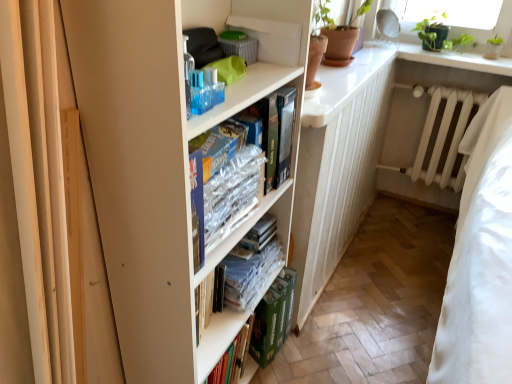
The image size is (512, 384). I want to click on white matte bookcase at center, so click(148, 175).

The width and height of the screenshot is (512, 384). What do you see at coordinates (205, 90) in the screenshot?
I see `transparent plastic bottle at upper center` at bounding box center [205, 90].

Describe the element at coordinates (273, 318) in the screenshot. I see `green cardboard book at lower center` at that location.

Measure the distance between white glossy counter top at upper right and camera.

white glossy counter top at upper right and camera are 1.29 meters apart.

The image size is (512, 384). Describe the element at coordinates (275, 133) in the screenshot. I see `hardcover book at center, the 2th book from the bottom` at that location.

This screenshot has width=512, height=384. What do you see at coordinates (251, 267) in the screenshot?
I see `clear plastic books at center, which appears as the 2th book when viewed from the top` at bounding box center [251, 267].

Find the location of `white smooth window sill at upper right`. white smooth window sill at upper right is located at coordinates (443, 58).

Locate an element on the screen. white matte bookcase at center is located at coordinates (148, 175).

Is hardcover book at center, the 2th book from the bottom, far from white matte bookcase at center?

That's not correct — hardcover book at center, the 2th book from the bottom, is a little close to white matte bookcase at center.

Is point (250, 114) in front of point (96, 26)?

No, it is behind (96, 26).

Is hardcover book at center, the 2th book from the bottom, smaller than white matte bookcase at center?

Correct, hardcover book at center, the 2th book from the bottom, occupies less space than white matte bookcase at center.

Is hardcover book at center, the first book when ordered from top to bottom, inside the boundaries of white matte bookcase at center, or outside?

hardcover book at center, the first book when ordered from top to bottom, lies within the bounds of white matte bookcase at center.

From the image's perspective, is white smooth window sill at upper right beneath white matte bookcase at center?

No, from the image's perspective, white smooth window sill at upper right is not below white matte bookcase at center.

Which of these two, white smooth window sill at upper right or white matte bookcase at center, is wider?

With larger width is white matte bookcase at center.

From their relative heights in the image, would you say white smooth window sill at upper right is taller or shorter than white matte bookcase at center?

Clearly, white smooth window sill at upper right is shorter compared to white matte bookcase at center.

Is the position of white smooth window sill at upper right more distant than that of white matte bookcase at center?

Yes.

Considering the positions of objects white matte radiator at center and white glossy counter top at upper right in the image provided, who is in front, white matte radiator at center or white glossy counter top at upper right?

Positioned in front is white glossy counter top at upper right.

Which of these two, white matte radiator at center or white glossy counter top at upper right, stands shorter?

Standing shorter between the two is white glossy counter top at upper right.

Is point (419, 155) behind point (345, 101)?

Yes, it is behind point (345, 101).

Can you tell me how much transparent plastic bottle at upper center and hardcover book at center, the first book when ordered from top to bottom, differ in facing direction?

The angle between the facing direction of transparent plastic bottle at upper center and the facing direction of hardcover book at center, the first book when ordered from top to bottom, is 7.76 degrees.

Are transparent plastic bottle at upper center and hardcover book at center, the first book when ordered from top to bottom, located far from each other?

No, transparent plastic bottle at upper center is not far away from hardcover book at center, the first book when ordered from top to bottom.

Is transparent plastic bottle at upper center taller or shorter than hardcover book at center, the 2th book from the bottom?

Clearly, transparent plastic bottle at upper center is shorter compared to hardcover book at center, the 2th book from the bottom.

Is point (209, 92) closer or farther from the camera than point (278, 122)?

Clearly, point (209, 92) is closer to the camera than point (278, 122).

Is white matte bookcase at center bigger than clear plastic books at center, which ranks as the first book in bottom-to-top order?

Yes.

This screenshot has width=512, height=384. What are the coordinates of `book below the white matte bookcase at center (from a real-world perspective)` in the screenshot? It's located at (251, 267).

Based on the photo, from a real-world perspective, does white matte bookcase at center sit lower than clear plastic books at center, which appears as the 2th book when viewed from the top?

No, from a real-world perspective, white matte bookcase at center is not beneath clear plastic books at center, which appears as the 2th book when viewed from the top.

Considering the relative positions of white matte bookcase at center and clear plastic books at center, which ranks as the first book in bottom-to-top order, in the image provided, is white matte bookcase at center to the right of clear plastic books at center, which ranks as the first book in bottom-to-top order, from the viewer's perspective?

No, white matte bookcase at center is not to the right of clear plastic books at center, which ranks as the first book in bottom-to-top order.

Locate an element on the screen. bookcase below the transparent plastic bottle at upper center (from the image's perspective) is located at coordinates (148, 175).

Between point (196, 99) and point (88, 141), which one is positioned in front?

Point (88, 141)

Considering the sizes of objects transparent plastic bottle at upper center and white matte bookcase at center in the image provided, who is shorter, transparent plastic bottle at upper center or white matte bookcase at center?

Standing shorter between the two is transparent plastic bottle at upper center.

Is white matte bookcase at center at the back of transparent plastic bottle at upper center?

Yes.

From a real-world perspective, between transparent plastic bottle at upper center and white smooth window sill at upper right, who is vertically lower?

white smooth window sill at upper right is physically lower.

Can you tell me how much transparent plastic bottle at upper center and white smooth window sill at upper right differ in facing direction?

They differ by 91.1 degrees in their facing directions.

Who is taller, transparent plastic bottle at upper center or white smooth window sill at upper right?

transparent plastic bottle at upper center is taller.

Does point (199, 80) come in front of point (478, 66)?

Yes.

At what (x,y) coordinates should I click in order to perform the action: click on bookcase located below the hardcover book at center, the 2th book from the bottom (from the image's perspective). Please return your answer as a coordinate pair (x, y). The height and width of the screenshot is (384, 512). Looking at the image, I should click on (148, 175).

Locate an element on the screen. The width and height of the screenshot is (512, 384). bookcase that appears in front of the white smooth window sill at upper right is located at coordinates (148, 175).

Looking at the image, which one is located closer to green cardboard book at lower center, white matte bookcase at center or hardcover book at center, the first book when ordered from top to bottom?

white matte bookcase at center lies closer to green cardboard book at lower center than the other object.

In the scene shown: Estimate the real-world distances between objects in this image. Which object is closer to clear plastic books at center, which ranks as the first book in bottom-to-top order, transparent plastic bottle at upper center or white smooth window sill at upper right?

transparent plastic bottle at upper center.

Estimate the real-world distances between objects in this image. Which object is closer to hardcover book at center, the first book when ordered from top to bottom, white matte bookcase at center or white glossy counter top at upper right?

Among the two, white matte bookcase at center is located nearer to hardcover book at center, the first book when ordered from top to bottom.

Estimate the real-world distances between objects in this image. Which object is closer to green cardboard book at lower center, white smooth window sill at upper right or transparent plastic bottle at upper center?

The object closer to green cardboard book at lower center is transparent plastic bottle at upper center.

Which object lies nearer to the anchor point white glossy counter top at upper right, hardcover book at center, the 2th book from the bottom, or white matte radiator at center?

hardcover book at center, the 2th book from the bottom.

Which object lies further to the anchor point green cardboard book at lower center, hardcover book at center, the 2th book from the bottom, or white matte bookcase at center?

hardcover book at center, the 2th book from the bottom, is positioned further to the anchor green cardboard book at lower center.

Considering their positions, is white matte radiator at center positioned further to white glossy counter top at upper right than white smooth window sill at upper right?

The object further to white glossy counter top at upper right is white matte radiator at center.

From the image, which object appears to be nearer to white matte bookcase at center, hardcover book at center, the 2th book from the bottom, or clear plastic books at center, which appears as the 2th book when viewed from the top?

Based on the image, hardcover book at center, the 2th book from the bottom, appears to be nearer to white matte bookcase at center.

Image resolution: width=512 pixels, height=384 pixels. Find the location of `bookcase between white glossy counter top at upper right and clear plastic books at center, which appears as the 2th book when viewed from the top, from top to bottom`. bookcase between white glossy counter top at upper right and clear plastic books at center, which appears as the 2th book when viewed from the top, from top to bottom is located at coordinates (148, 175).

Locate an element on the screen. This screenshot has width=512, height=384. counter top between hardcover book at center, the first book when ordered from top to bottom, and white matte radiator at center, along the z-axis is located at coordinates (344, 83).

Locate an element on the screen. This screenshot has width=512, height=384. toiletry between white glossy counter top at upper right and green cardboard book at lower center from top to bottom is located at coordinates (205, 90).

Find the location of a particular element. The height and width of the screenshot is (384, 512). paperback book between transparent plastic bottle at upper center and white smooth window sill at upper right in the front-back direction is located at coordinates (273, 318).